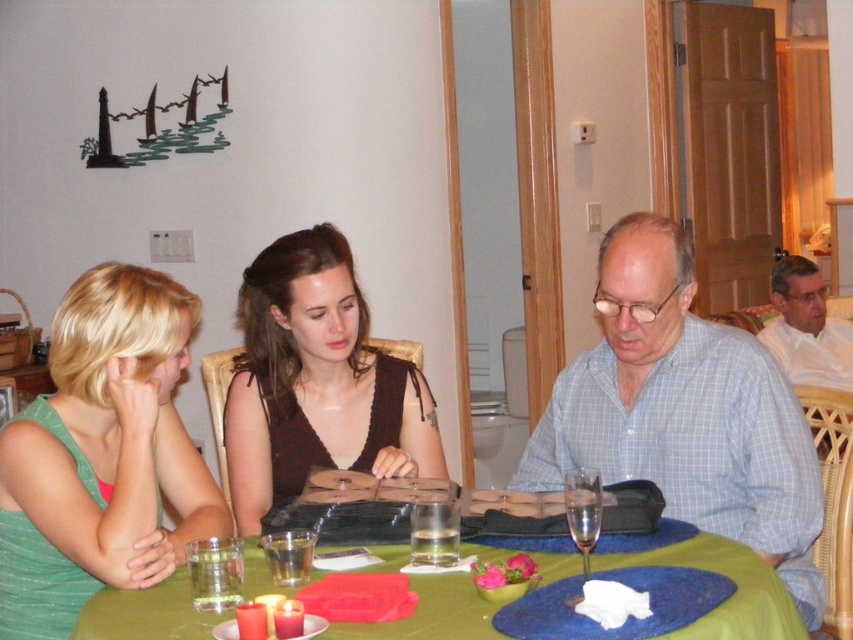
You are standing 5 feet away from the dining table. You want to grab the matte brown dress at center. Can you reach it without moving closer?

The matte brown dress at center is 6.48 feet away from the camera. Since you are 5 feet away from the dining table, you are currently 5 feet away from the matte brown dress at center. Therefore, you can reach it without moving closer because 5 feet is less than 6.48 feet.

You are a photographer trying to capture a candid shot of the light blue checkered shirt at center and the white shirt at right. Since you want both subjects to be in the frame, which direction should you position your camera relative to the subjects?

The light blue checkered shirt at center is positioned on the left side of white shirt at right, so you should position your camera to the left of the subjects to ensure both are in the frame.

You are standing at the entrance of the room and want to place a decorative item on the green fabric table at center. Based on its position, where should you walk to reach the table?

The green fabric table at center is located at point (730, 596), so you should walk towards the coordinates (730, 596) to reach the table.